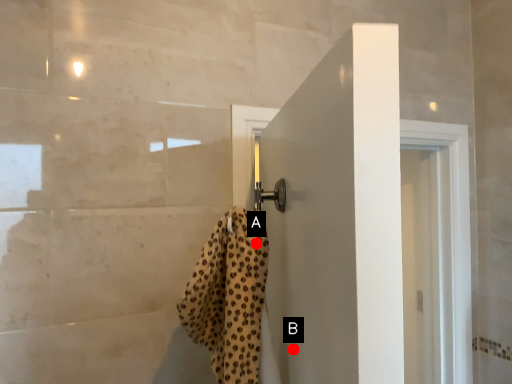
Question: Two points are circled on the image, labeled by A and B beside each circle. Which point is closer to the camera?

Choices:
 (A) A is closer
 (B) B is closer

Answer: (B)